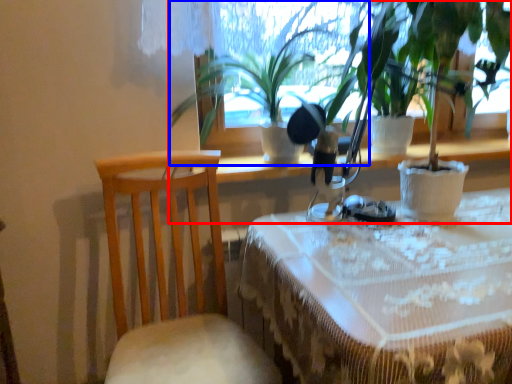
Question: Which object appears farthest to the camera in this image, houseplant (highlighted by a red box) or houseplant (highlighted by a blue box)?

Choices:
 (A) houseplant
 (B) houseplant

Answer: (B)